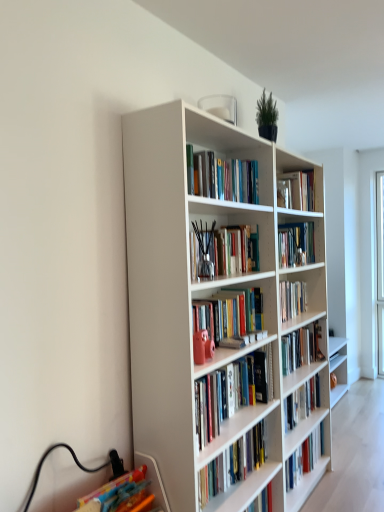
Question: Based on their sizes in the image, would you say hardcover book at upper center, the 1th book viewed from the top, is bigger or smaller than white glossy bookshelf at center, arranged as the 1th book when ordered from the bottom?

Choices:
 (A) small
 (B) big

Answer: (A)

Question: Relative to white glossy bookshelf at center, which is the 4th book in top-to-bottom order, is hardcover book at upper center, the 1th book viewed from the top, in front or behind?

Choices:
 (A) front
 (B) behind

Answer: (B)

Question: Estimate the real-world distances between objects in this image. Which object is farther from the hardcover books at upper center, which is counted as the third book, starting from the bottom?

Choices:
 (A) white matte bookcase at center
 (B) white glossy bookshelf at center, arranged as the 1th book when ordered from the bottom
 (C) hardcover book at upper center, which appears as the fourth book when ordered from the bottom
 (D) translucent glass vase at center, which is counted as the third book, starting from the top

Answer: (B)

Question: Which object is the closest to the white matte bookcase at center?

Choices:
 (A) hardcover books at upper center, the second book when ordered from top to bottom
 (B) white glossy bookshelf at center, which is the 4th book in top-to-bottom order
 (C) hardcover book at upper center, which appears as the fourth book when ordered from the bottom
 (D) translucent glass vase at center, which is counted as the third book, starting from the top

Answer: (B)